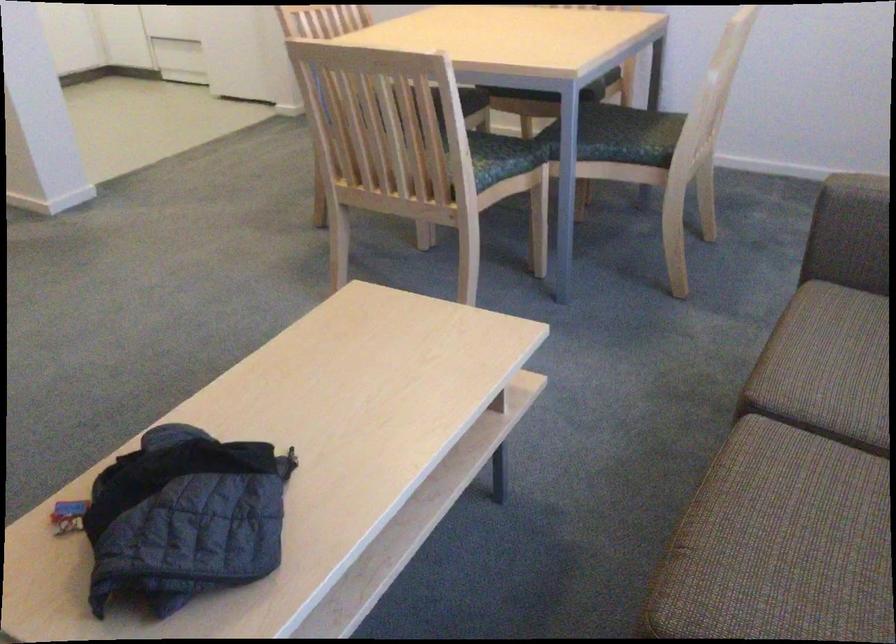
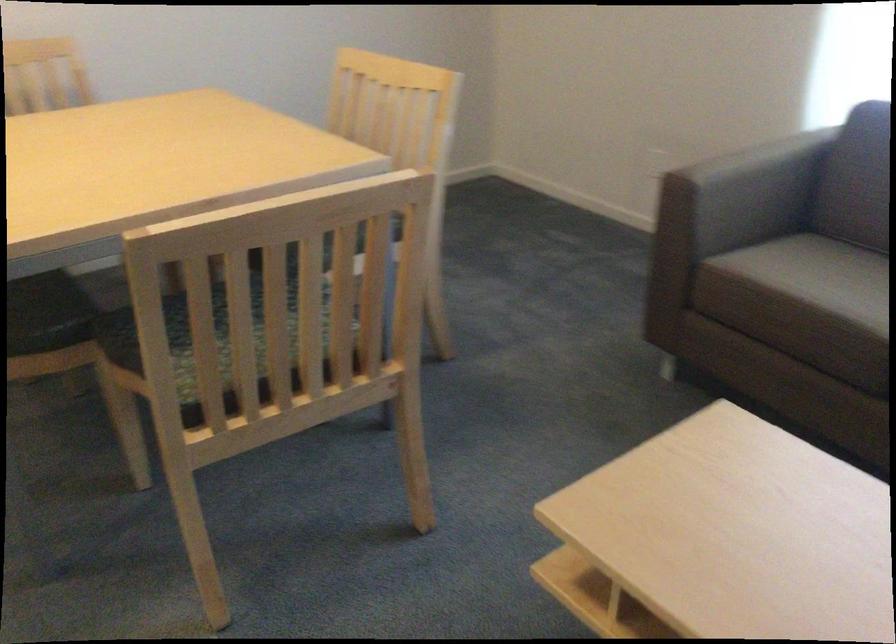
Question: I am providing you with two images of the same scene from different viewpoints. After the viewpoint changes to image2, which objects are now occluded?

Choices:
 (A) brown sofa armrest
 (B) glass food jar
 (C) green chair sitting surface
 (D) chair sitting surface

Answer: (C)